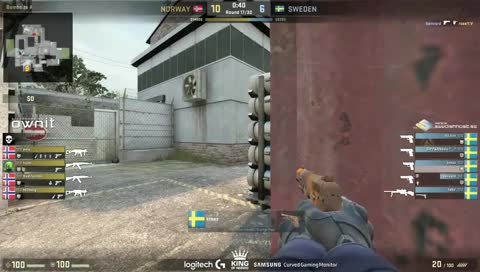
In order to click on wall in this screenshot , I will do `click(340, 137)`.